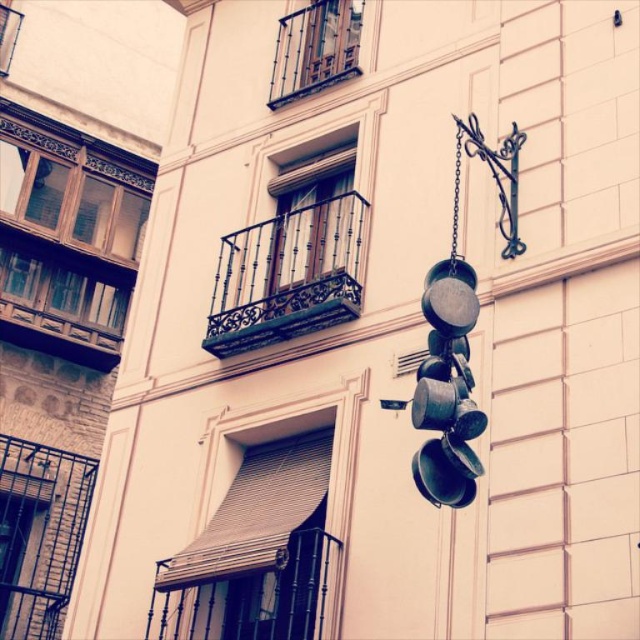
Question: Considering the real-world distances, which object is farthest from the dark brown wrought iron balcony at center?

Choices:
 (A) polished metal balcony at upper center
 (B) green matte pans at right

Answer: (B)

Question: Which object is closer to the camera taking this photo?

Choices:
 (A) green matte pans at right
 (B) dark brown wrought iron balcony at center
 (C) polished metal balcony at upper center

Answer: (A)

Question: Can you confirm if dark brown wrought iron balcony at center is thinner than polished metal balcony at upper center?

Choices:
 (A) no
 (B) yes

Answer: (B)

Question: Which object appears closest to the camera in this image?

Choices:
 (A) green matte pans at right
 (B) dark brown wrought iron balcony at center
 (C) polished metal balcony at upper center

Answer: (A)

Question: Does dark brown wrought iron balcony at center appear over green matte pans at right?

Choices:
 (A) yes
 (B) no

Answer: (A)

Question: Is dark brown wrought iron balcony at center to the right of polished metal balcony at upper center from the viewer's perspective?

Choices:
 (A) yes
 (B) no

Answer: (B)